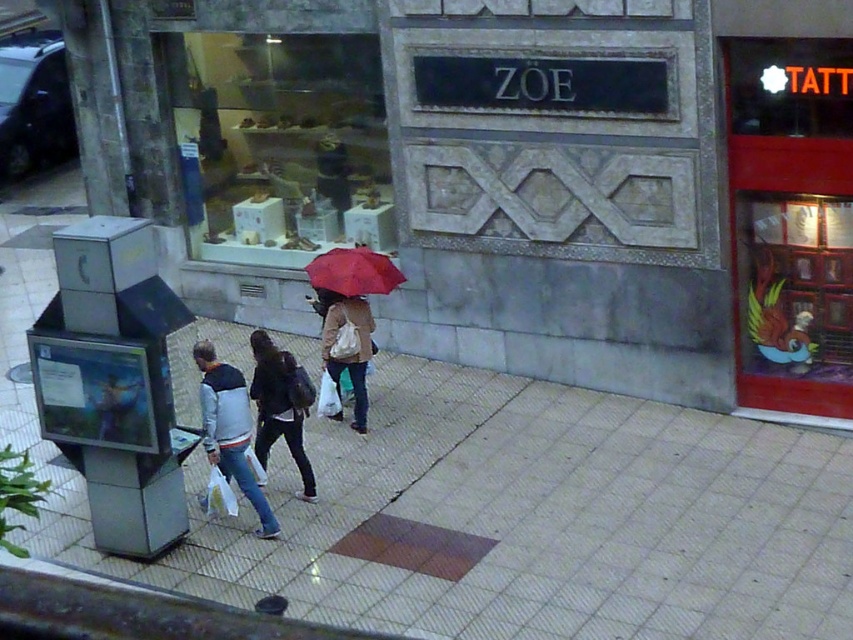
Question: Can you confirm if smooth concrete pavement at center is bigger than matte brown coat at center?

Choices:
 (A) yes
 (B) no

Answer: (A)

Question: Which of the following is the closest to the observer?

Choices:
 (A) (357, 333)
 (B) (337, 540)

Answer: (B)

Question: Can you confirm if white cotton jacket at center is bigger than red matte umbrella at center?

Choices:
 (A) yes
 (B) no

Answer: (A)

Question: Which of these objects is positioned closest to the red matte umbrella at center?

Choices:
 (A) matte brown coat at center
 (B) dark gray fabric jacket at center
 (C) white cotton jacket at center

Answer: (A)

Question: Where is dark gray fabric jacket at center located in relation to matte brown coat at center in the image?

Choices:
 (A) right
 (B) left

Answer: (B)

Question: Which point appears farthest from the camera in this image?

Choices:
 (A) (306, 484)
 (B) (364, 330)
 (C) (335, 291)
 (D) (219, 401)

Answer: (B)